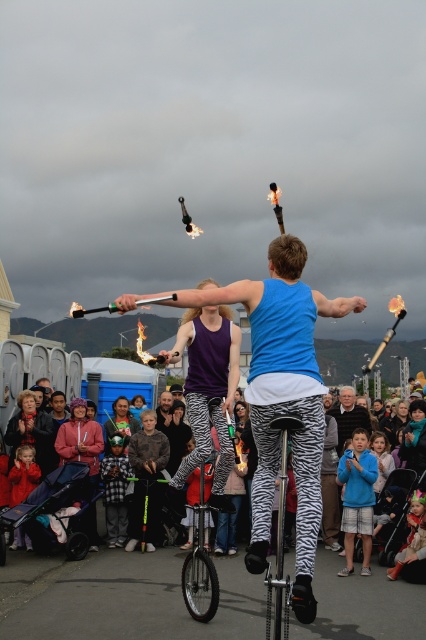
Question: Is blue fabric shirt at center to the left of dark brown leather jacket at center from the viewer's perspective?

Choices:
 (A) no
 (B) yes

Answer: (A)

Question: Among these objects, which one is farthest from the camera?

Choices:
 (A) blue fabric shirt at center
 (B) multicolored fabric crowd at center
 (C) dark brown leather jacket at center
 (D) zebra-patterned pants at center

Answer: (C)

Question: Which of these objects is positioned farthest from the gray hair at center?

Choices:
 (A) dark brown leather jacket at center
 (B) blue fabric shirt at center
 (C) zebra-patterned pants at center

Answer: (C)

Question: Can you confirm if blue fabric shirt at center is positioned above dark brown leather jacket at center?

Choices:
 (A) yes
 (B) no

Answer: (B)

Question: Which point is farther from the camera taking this photo?

Choices:
 (A) (160, 420)
 (B) (347, 426)

Answer: (A)

Question: Is zebra-patterned pants at center to the right of zebra print monocycle at lower left from the viewer's perspective?

Choices:
 (A) no
 (B) yes

Answer: (B)